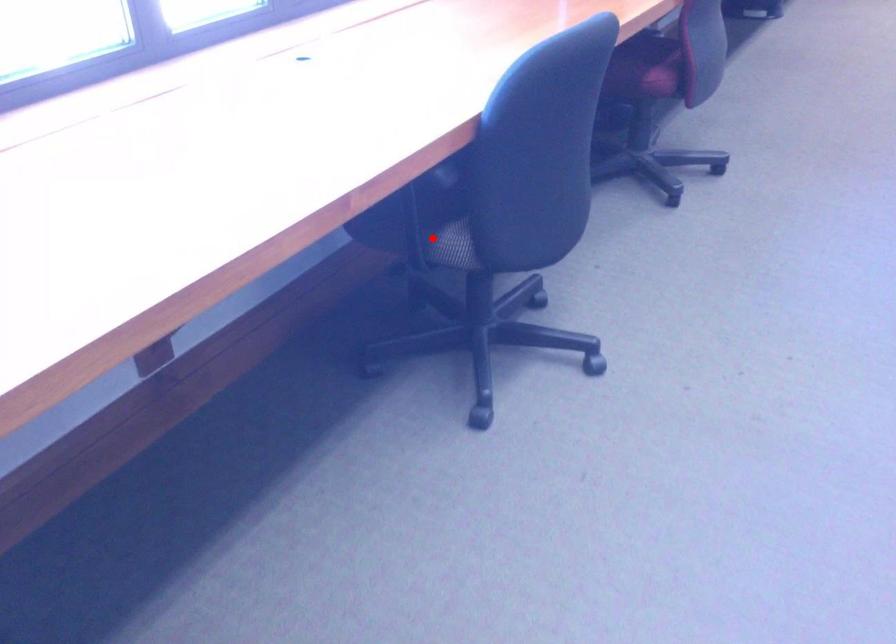
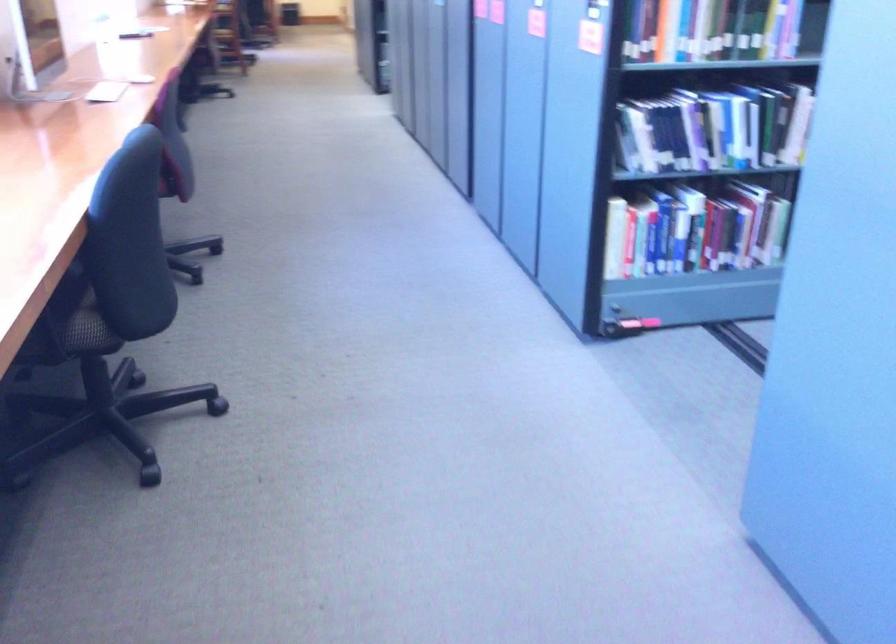
Where in the second image is the point corresponding to the highlighted location from the first image?

(73, 324)